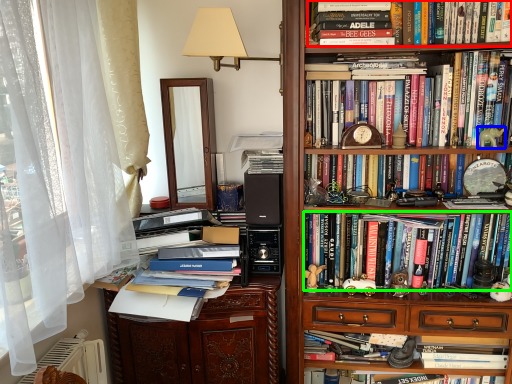
Question: Estimate the real-world distances between objects in this image. Which object is closer to book (highlighted by a red box), toy (highlighted by a blue box) or book (highlighted by a green box)?

Choices:
 (A) toy
 (B) book

Answer: (A)